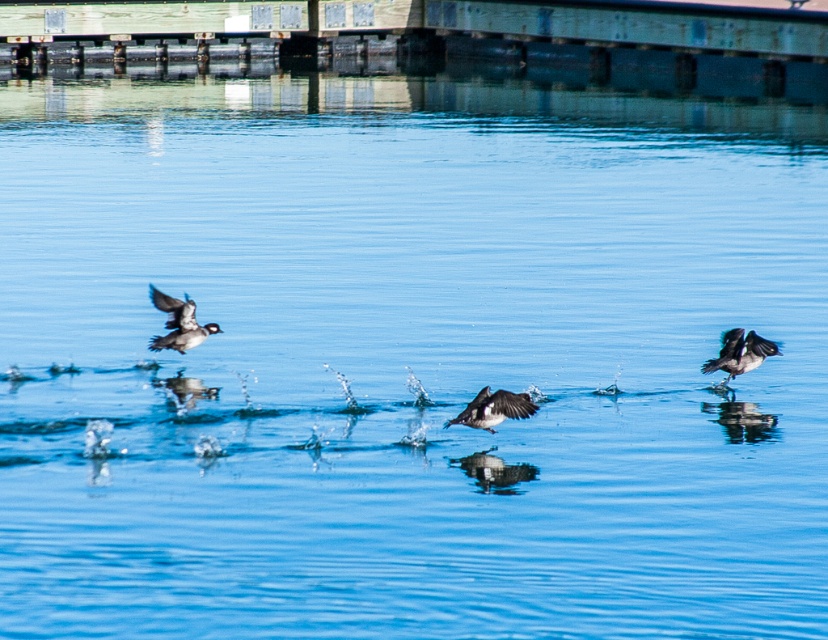
Question: Which point is farther to the camera?

Choices:
 (A) (744, 362)
 (B) (477, 406)

Answer: (A)

Question: Among these points, which one is farthest from the camera?

Choices:
 (A) (514, 413)
 (B) (786, 36)
 (C) (744, 356)
 (D) (177, 301)

Answer: (B)

Question: Can you confirm if speckled feathered duck at center is wider than dark brown feathers at right?

Choices:
 (A) no
 (B) yes

Answer: (A)

Question: Which of the following is the closest to the observer?

Choices:
 (A) pos(742,340)
 (B) pos(494,417)
 (C) pos(162,300)
 (D) pos(349,56)

Answer: (B)

Question: Is the position of green painted wood at upper center less distant than that of speckled feathered duck at center?

Choices:
 (A) yes
 (B) no

Answer: (B)

Question: Does green painted wood at upper center have a greater width compared to speckled feathered duck at center?

Choices:
 (A) no
 (B) yes

Answer: (B)